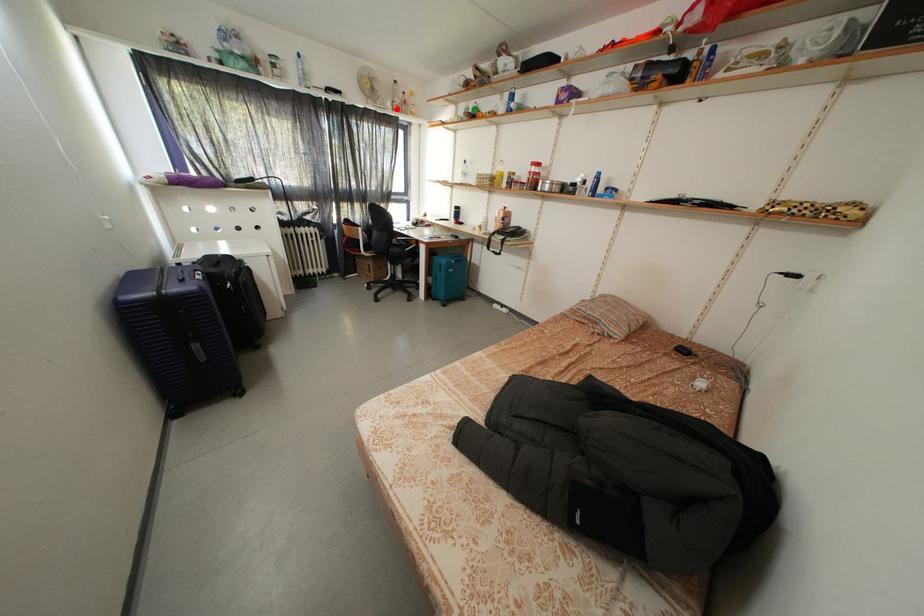
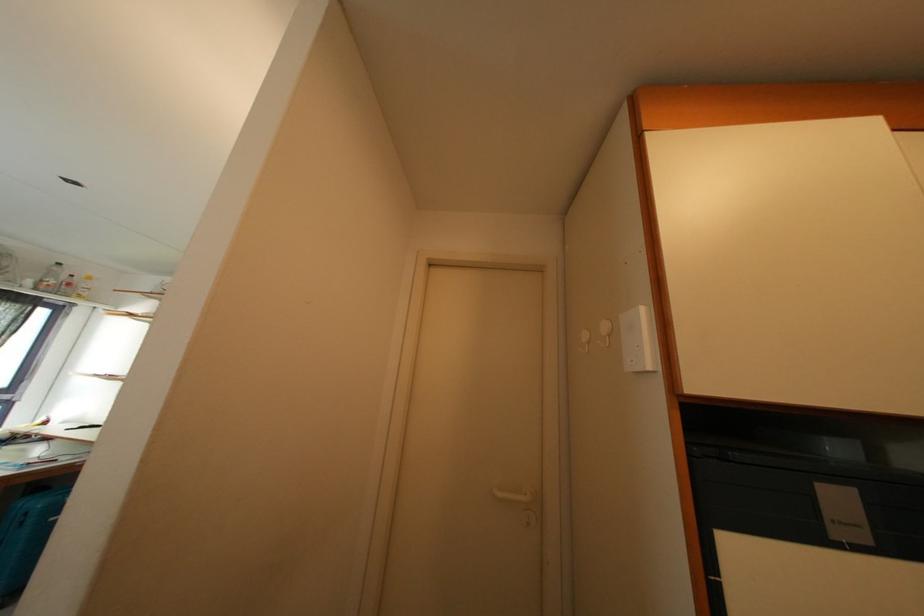
Locate, in the second image, the point that corresponds to the highlighted location in the first image.

(38, 286)